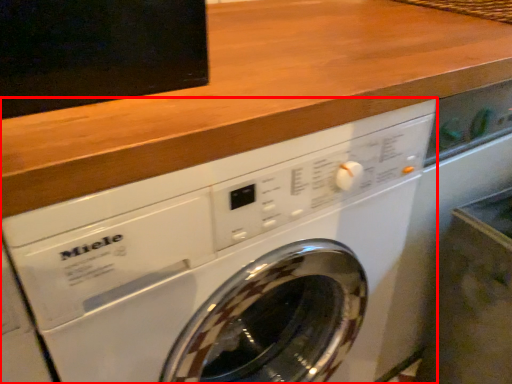
Question: From the image, what is the correct spatial relationship of washing machine (annotated by the red box) in relation to counter top?

Choices:
 (A) left
 (B) right

Answer: (A)